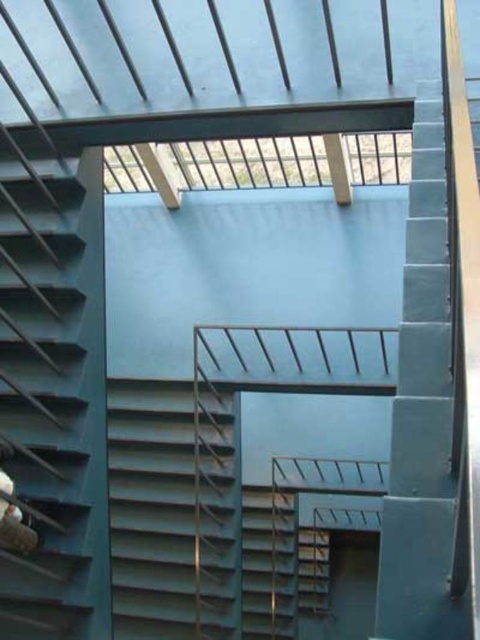
Question: Which is farther from the metallic gray stairs at center?

Choices:
 (A) metallic gray stairs at left
 (B) metallic gray stair at center

Answer: (A)

Question: Which object is the farthest from the metallic gray stairs at center?

Choices:
 (A) metallic gray stairs at left
 (B) metallic gray stair at center

Answer: (A)

Question: Is metallic gray stairs at left further to camera compared to metallic gray stairs at center?

Choices:
 (A) yes
 (B) no

Answer: (B)

Question: Is metallic gray stairs at center positioned before metallic gray stair at center?

Choices:
 (A) yes
 (B) no

Answer: (A)

Question: Can you confirm if metallic gray stairs at left is wider than metallic gray stairs at center?

Choices:
 (A) no
 (B) yes

Answer: (A)

Question: Which object is the closest to the metallic gray stairs at left?

Choices:
 (A) metallic gray stairs at center
 (B) metallic gray stair at center

Answer: (A)